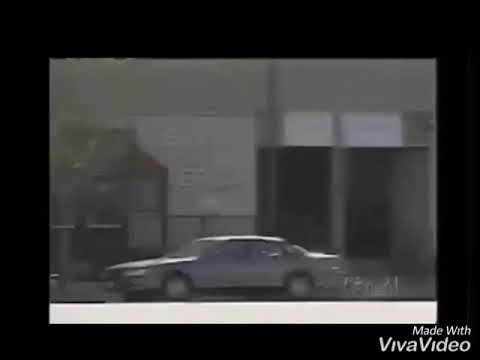
This screenshot has height=360, width=480. I want to click on pillar, so click(335, 201).